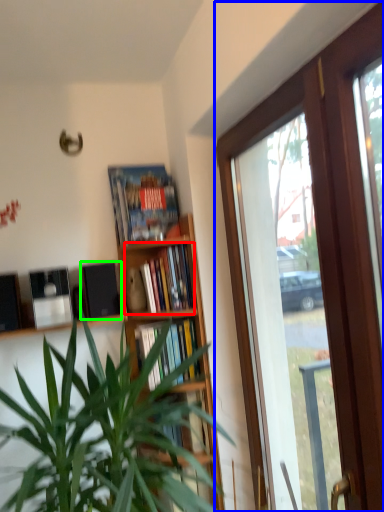
Question: Based on their relative distances, which object is nearer to book (highlighted by a red box)? Choose from window (highlighted by a blue box) and loudspeaker (highlighted by a green box).

Choices:
 (A) window
 (B) loudspeaker

Answer: (B)